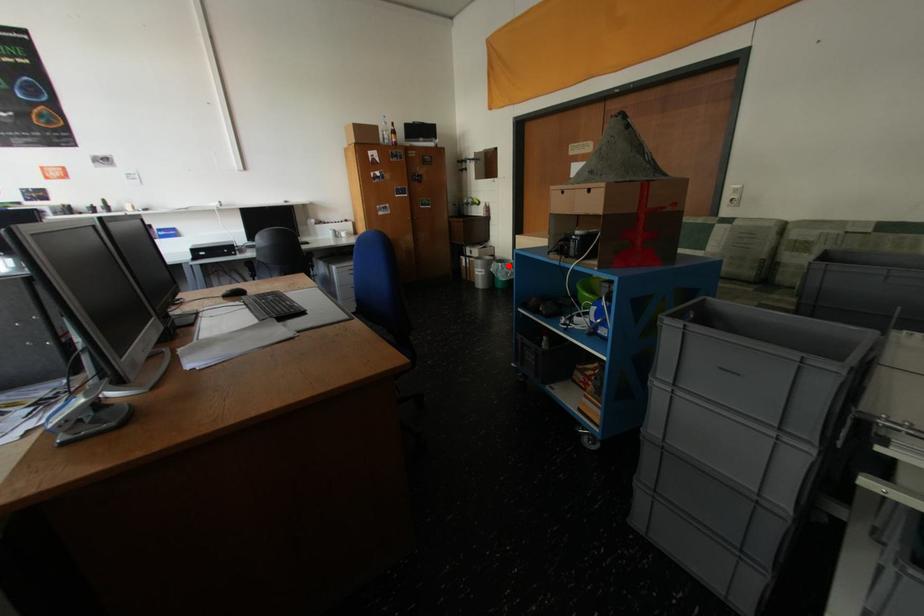
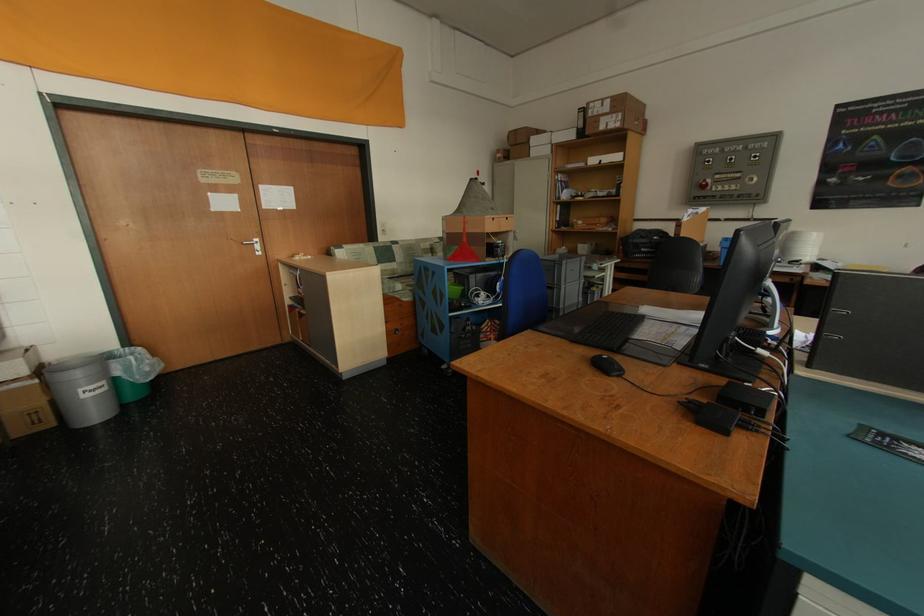
Where in the second image is the point corresponding to the highlighted location from the first image?

(140, 359)